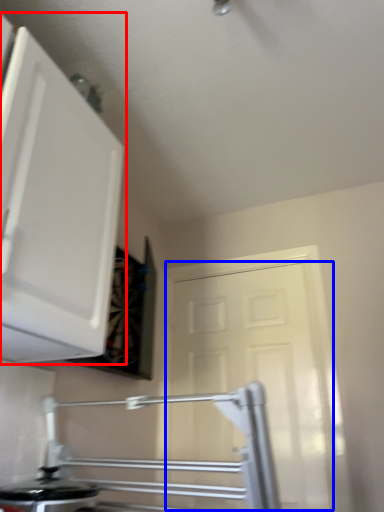
Question: Which point is further to the camera, cabinetry (highlighted by a red box) or door (highlighted by a blue box)?

Choices:
 (A) cabinetry
 (B) door

Answer: (B)